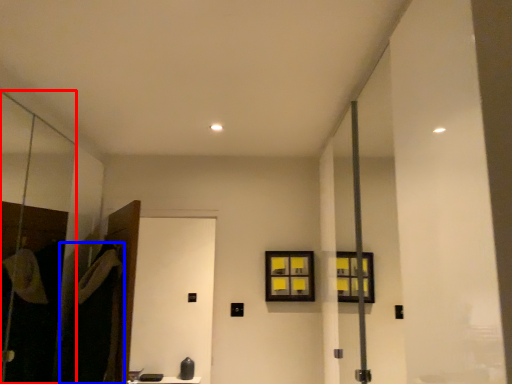
Question: Which of the following is the farthest to the observer, screen door (highlighted by a red box) or robe (highlighted by a blue box)?

Choices:
 (A) screen door
 (B) robe

Answer: (B)